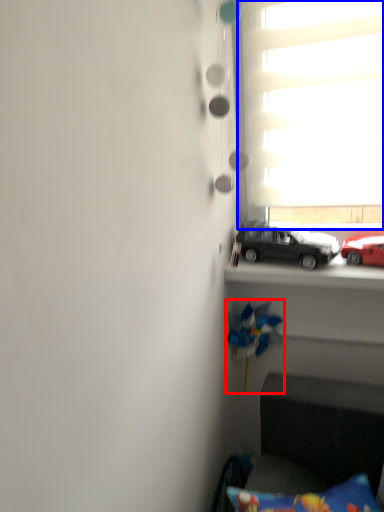
Question: Which of the following is the farthest to the observer, toy (highlighted by a red box) or window (highlighted by a blue box)?

Choices:
 (A) toy
 (B) window

Answer: (A)